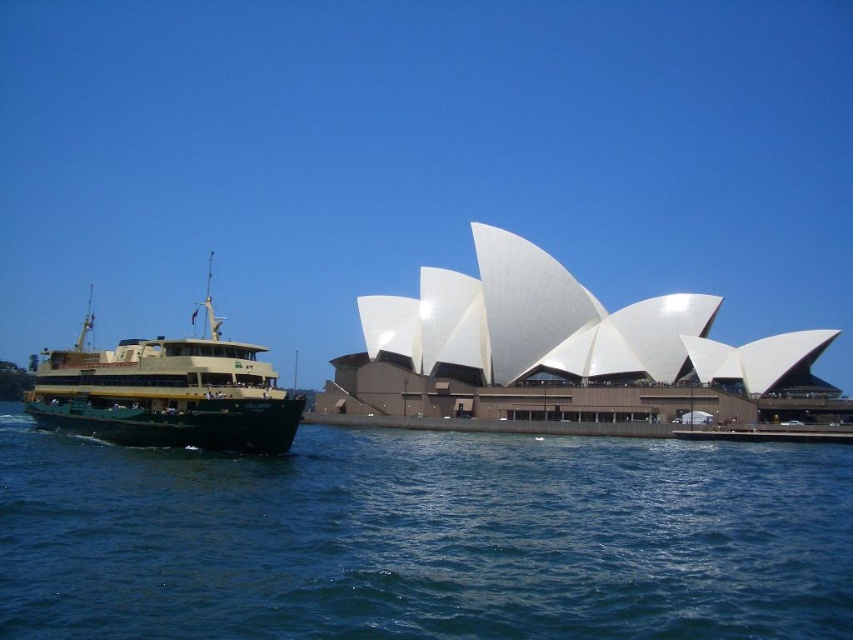
Who is higher up, blue water at lower left or green matte/yellow ferry at left?

green matte/yellow ferry at left

Can you confirm if blue water at lower left is positioned above green matte/yellow ferry at left?

Incorrect, blue water at lower left is not positioned above green matte/yellow ferry at left.

The height and width of the screenshot is (640, 853). Identify the location of blue water at lower left. (422, 538).

This screenshot has height=640, width=853. I want to click on blue water at lower left, so click(x=422, y=538).